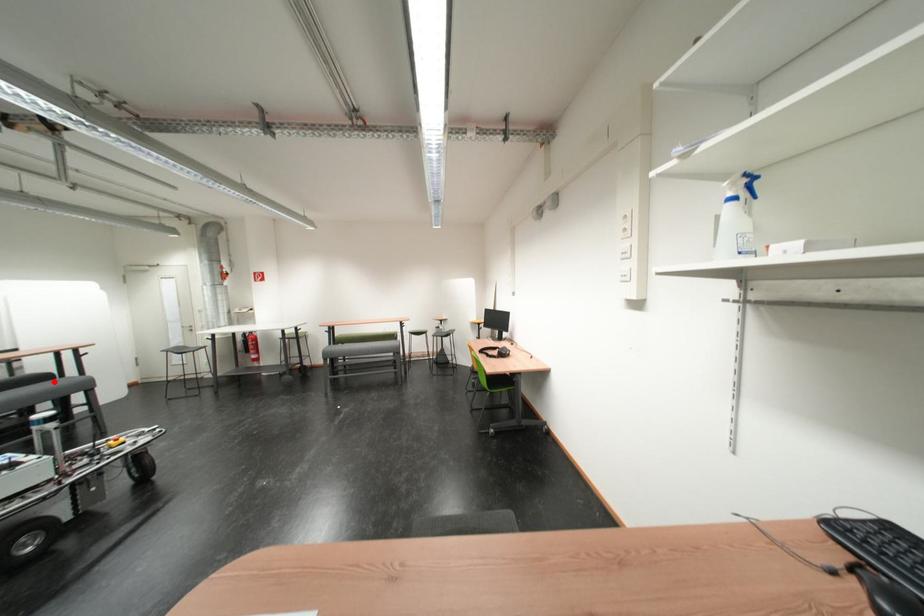
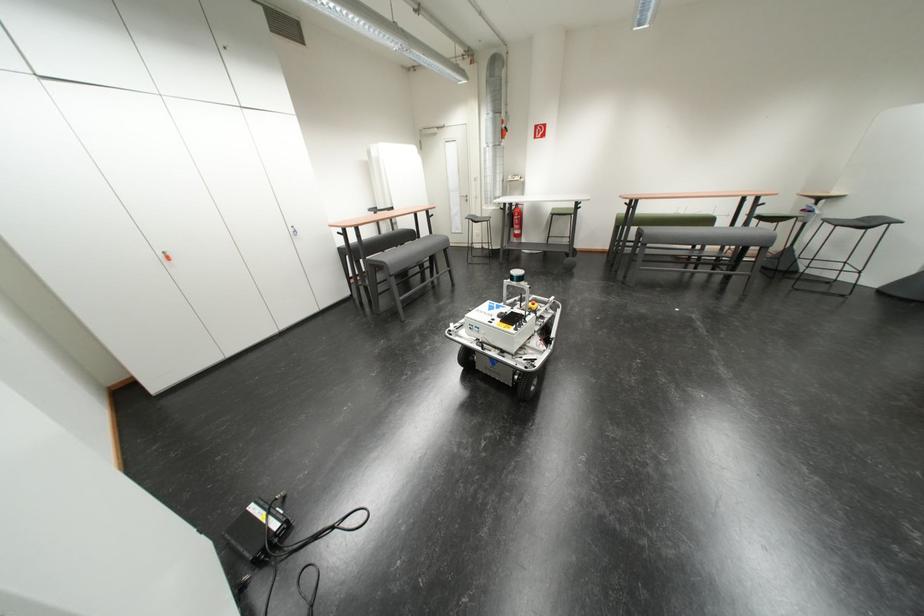
Where in the second image is the point corresponding to the highlighted location from the first image?

(423, 237)